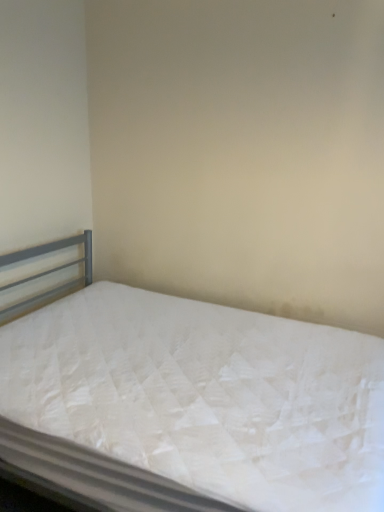
Image resolution: width=384 pixels, height=512 pixels. What do you see at coordinates (191, 405) in the screenshot? I see `white quilted mattress at center` at bounding box center [191, 405].

Measure the distance between white quilted mattress at center and camera.

The distance of white quilted mattress at center from camera is 1.21 meters.

This screenshot has height=512, width=384. Find the location of `white quilted mattress at center`. white quilted mattress at center is located at coordinates (191, 405).

Where is `white quilted mattress at center`? white quilted mattress at center is located at coordinates (191, 405).